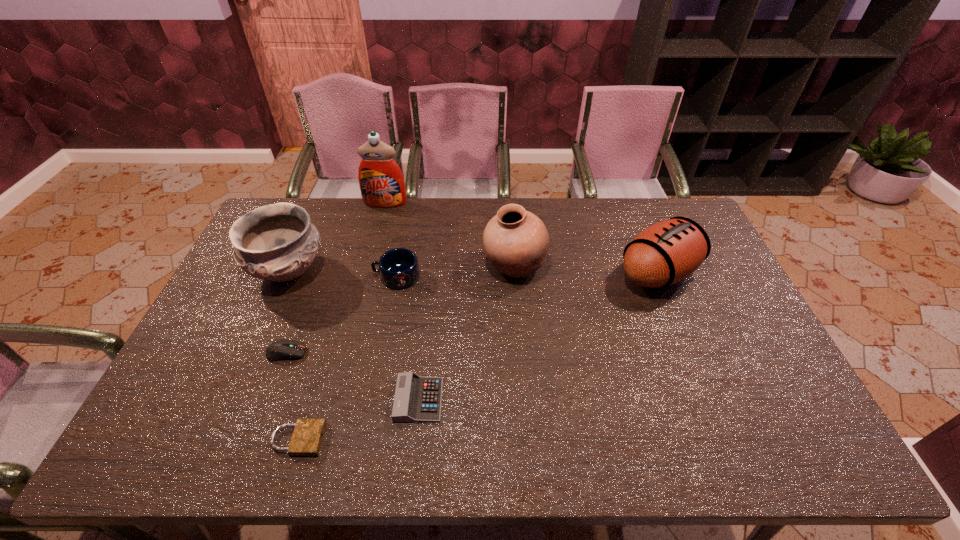
Locate an element on the screen. free spot between the computer equipment and the calculator is located at coordinates (352, 376).

What are the coordinates of `vacant region between the football (American) and the right pottery` in the screenshot? It's located at (587, 269).

This screenshot has height=540, width=960. I want to click on free space between the football (American) and the third nearest object, so click(472, 313).

Where is `vacant region between the calculator and the sixth farthest object`? The height and width of the screenshot is (540, 960). vacant region between the calculator and the sixth farthest object is located at coordinates (352, 376).

Find the location of `free space between the padlock and the computer equipment`. free space between the padlock and the computer equipment is located at coordinates (292, 396).

The image size is (960, 540). What are the coordinates of `vacant space that's between the rightmost object and the shorter pottery` in the screenshot? It's located at (474, 272).

Where is `vacant space that's between the second nearest object and the computer equipment`? The width and height of the screenshot is (960, 540). vacant space that's between the second nearest object and the computer equipment is located at coordinates (352, 376).

Locate which object is the sixth closest to the sixth farthest object. Please provide its 2D coordinates. Your answer should be formatted as a tuple, i.e. [(x, y)], where the tuple contains the x and y coordinates of a point satisfying the conditions above.

[(381, 181)]

Locate which object ranks second in proximity to the calculator. Please provide its 2D coordinates. Your answer should be formatted as a tuple, i.e. [(x, y)], where the tuple contains the x and y coordinates of a point satisfying the conditions above.

[(279, 350)]

Find the location of a particular element. The width and height of the screenshot is (960, 540). vacant space that satisfies the following two spatial constraints: 1. on the front side of the calculator; 2. on the left side of the left pottery is located at coordinates 232,400.